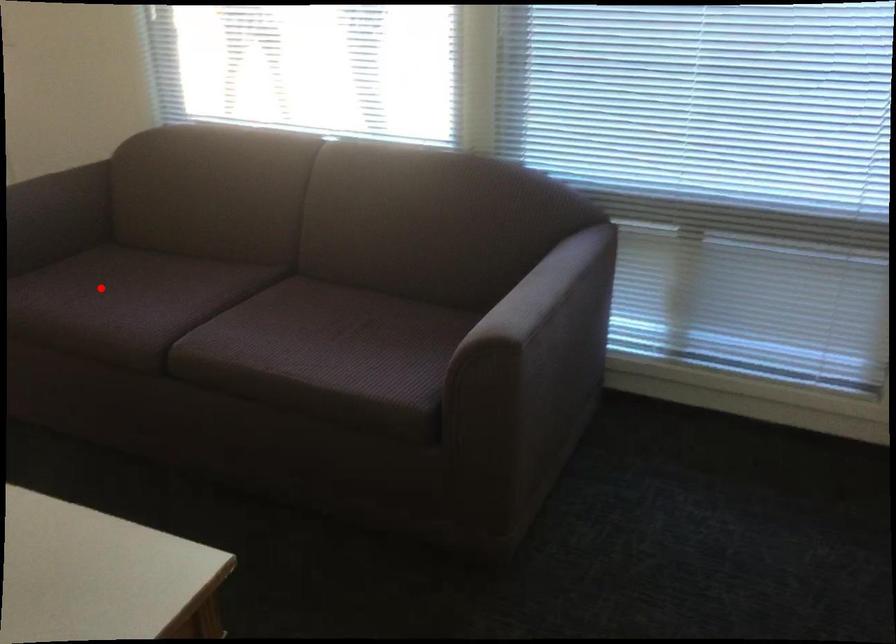
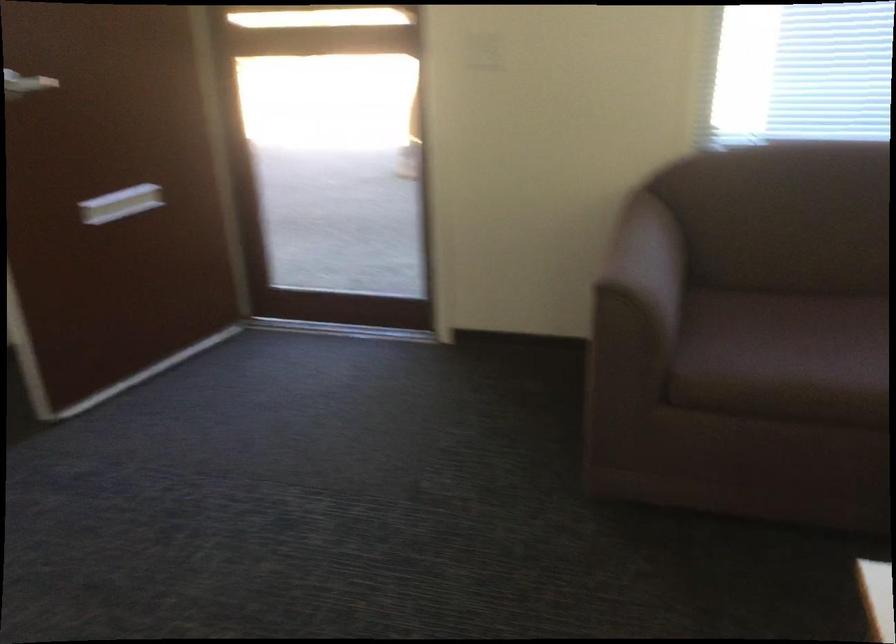
In the second image, find the point that corresponds to the highlighted location in the first image.

(786, 337)